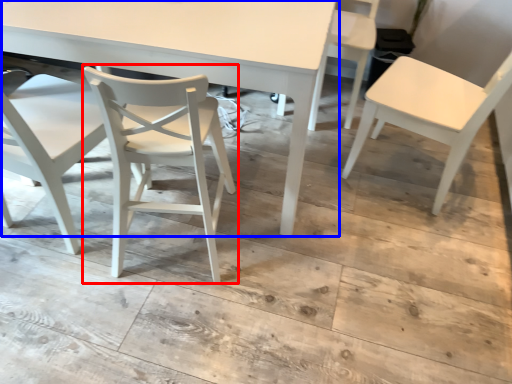
Question: Which of the following is the farthest to the observer, chair (highlighted by a red box) or table (highlighted by a blue box)?

Choices:
 (A) chair
 (B) table

Answer: (B)